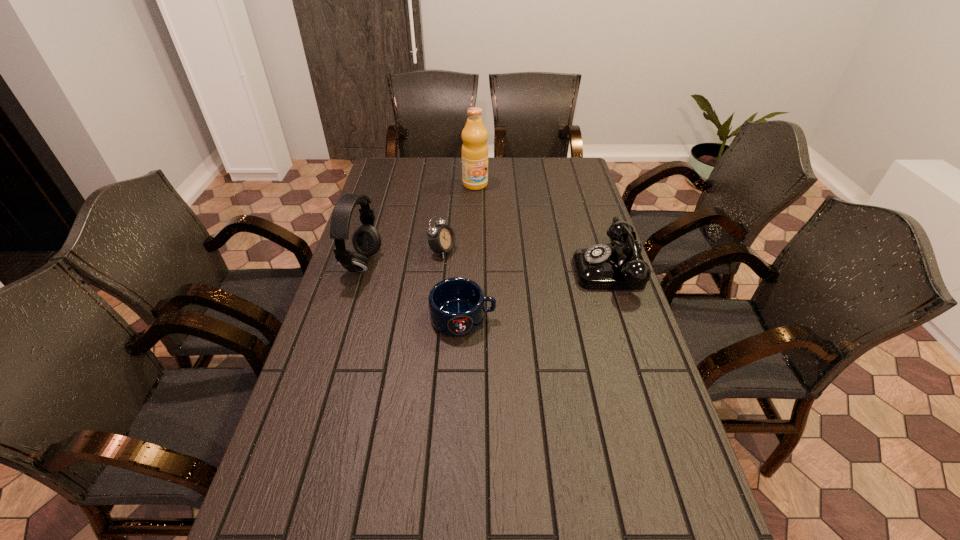
The image size is (960, 540). In order to click on object that is at the far edge in this screenshot , I will do `click(474, 135)`.

Locate an element on the screen. The image size is (960, 540). object situated at the left edge is located at coordinates (366, 240).

In order to click on object that is at the right edge in this screenshot , I will do `click(601, 267)`.

Identify the location of blank space at the far edge of the desktop. The image size is (960, 540). point(527,163).

In order to click on vacant region at the near edge of the desktop in this screenshot , I will do `click(503, 498)`.

At what (x,y) coordinates should I click in order to perform the action: click on vacant space at the left edge. Please return your answer as a coordinate pair (x, y). This screenshot has height=540, width=960. Looking at the image, I should click on (374, 301).

At what (x,y) coordinates should I click in order to perform the action: click on vacant point at the right edge. Please return your answer as a coordinate pair (x, y). Image resolution: width=960 pixels, height=540 pixels. Looking at the image, I should click on (668, 431).

The image size is (960, 540). In order to click on blank space at the far left corner of the desktop in this screenshot , I will do `click(395, 171)`.

This screenshot has height=540, width=960. In order to click on vacant area at the far right corner in this screenshot , I will do `click(580, 169)`.

Locate an element on the screen. This screenshot has width=960, height=540. free space at the near right corner is located at coordinates (698, 527).